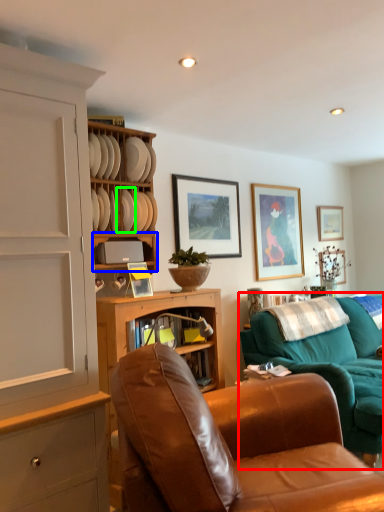
Question: Which is nearer to the studio couch (highlighted by a red box)? shelf (highlighted by a blue box) or plate (highlighted by a green box).

Choices:
 (A) shelf
 (B) plate

Answer: (A)